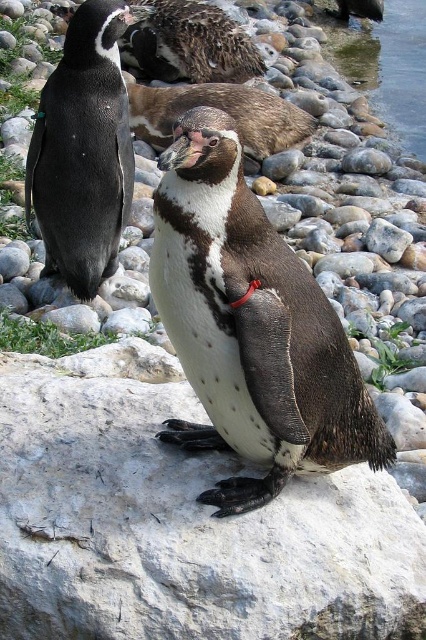
Question: Which point is farther to the camera?

Choices:
 (A) (336, 48)
 (B) (245, 145)

Answer: (A)

Question: Which object is positioned closest to the black glossy penguin at left?

Choices:
 (A) clear water at right
 (B) speckled brown penguin at upper center
 (C) gray rock at center
 (D) white speckled feathers at center

Answer: (C)

Question: Does gray rock at center have a greater width compared to black glossy penguin at left?

Choices:
 (A) no
 (B) yes

Answer: (B)

Question: Can you confirm if white speckled feathers at center is smaller than black glossy penguin at left?

Choices:
 (A) yes
 (B) no

Answer: (A)

Question: Which point is closer to the camera?

Choices:
 (A) speckled brown penguin at upper center
 (B) clear water at right
 (C) gray rock at center
 (D) speckled brown penguin at center

Answer: (C)

Question: Where is clear water at right located in relation to speckled brown penguin at upper center in the image?

Choices:
 (A) right
 (B) left

Answer: (A)